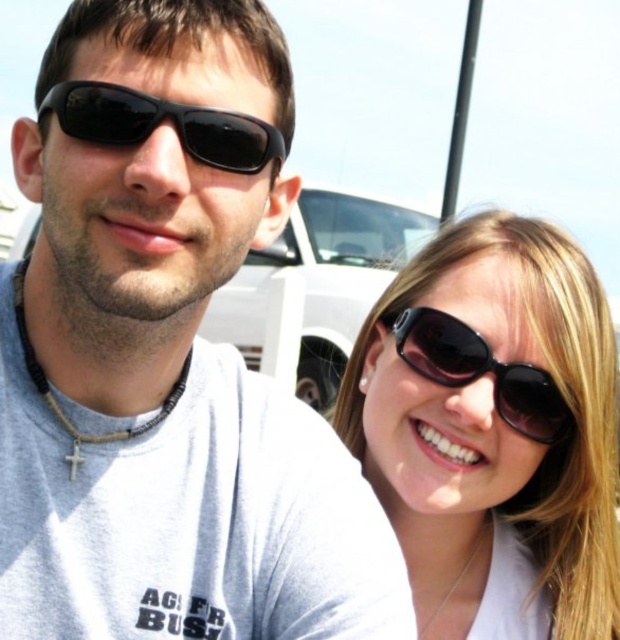
Question: Which of the following is the closest to the observer?

Choices:
 (A) matte black sunglasses at upper left
 (B) matte black sunglasses at right
 (C) black matte sunglasses at upper center
 (D) black matte sunglasses at upper right

Answer: (A)

Question: Does matte black sunglasses at upper left have a larger size compared to black matte sunglasses at upper center?

Choices:
 (A) no
 (B) yes

Answer: (B)

Question: Does matte black sunglasses at right have a smaller size compared to black matte sunglasses at upper center?

Choices:
 (A) yes
 (B) no

Answer: (A)

Question: Which point is farther to the camera?

Choices:
 (A) (205, 141)
 (B) (467, 381)

Answer: (B)

Question: Does matte black sunglasses at upper left appear on the right side of black matte sunglasses at upper center?

Choices:
 (A) yes
 (B) no

Answer: (B)

Question: Among these objects, which one is farthest from the camera?

Choices:
 (A) matte black sunglasses at right
 (B) black matte sunglasses at upper right
 (C) black matte sunglasses at upper center

Answer: (A)